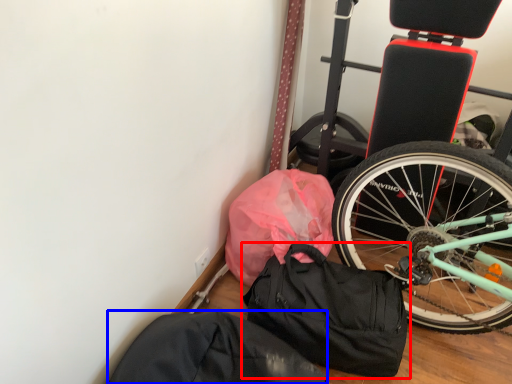
Question: Which object appears farthest to the camera in this image, luggage and bags (highlighted by a red box) or sack (highlighted by a blue box)?

Choices:
 (A) luggage and bags
 (B) sack

Answer: (A)